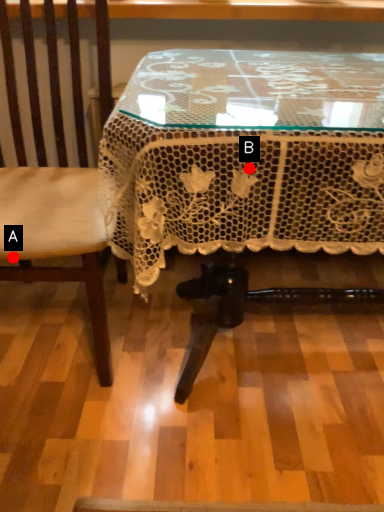
Question: Two points are circled on the image, labeled by A and B beside each circle. Which of the following is the closest to the observer?

Choices:
 (A) A is closer
 (B) B is closer

Answer: (B)